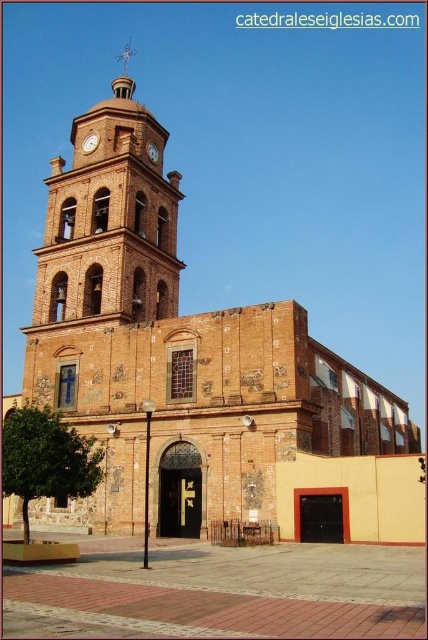
Can you confirm if wooden clock at center is wider than matte brown clock at upper center?

No.

Is wooden clock at center smaller than matte brown clock at upper center?

Yes.

I want to click on wooden clock at center, so click(x=89, y=141).

Is brown brick bell tower at center to the left of matte brown clock at upper center from the viewer's perspective?

Indeed, brown brick bell tower at center is positioned on the left side of matte brown clock at upper center.

Can you confirm if brown brick bell tower at center is bigger than matte brown clock at upper center?

Yes, brown brick bell tower at center is bigger than matte brown clock at upper center.

Describe the element at coordinates (109, 220) in the screenshot. I see `brown brick bell tower at center` at that location.

At what (x,y) coordinates should I click in order to perform the action: click on brown brick bell tower at center. Please return your answer as a coordinate pair (x, y). Looking at the image, I should click on (109, 220).

Which is above, brown brick bell tower at center or wooden clock at center?

Positioned higher is brown brick bell tower at center.

Who is more forward, (124, 200) or (88, 150)?

Point (124, 200) is more forward.

Locate an element on the screen. brown brick bell tower at center is located at coordinates (109, 220).